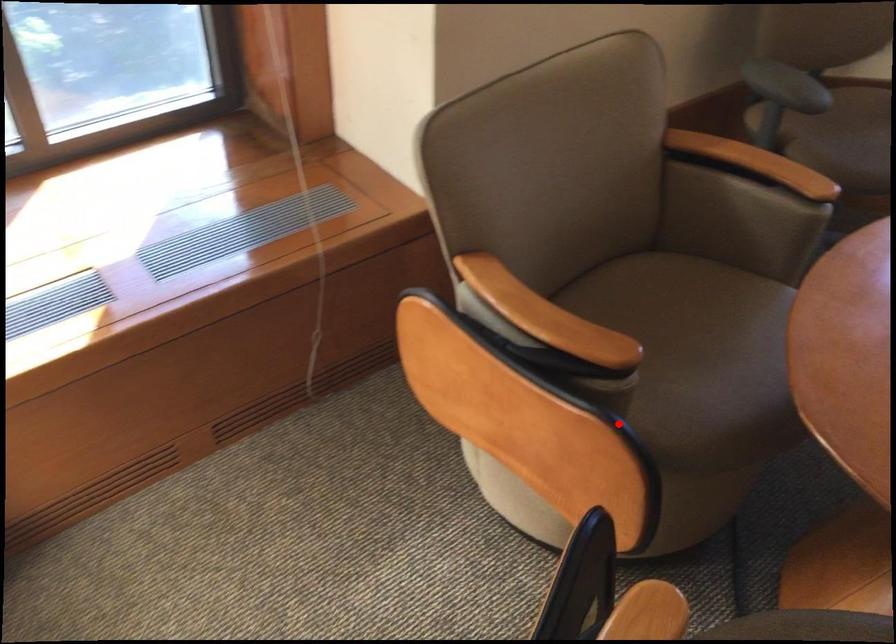
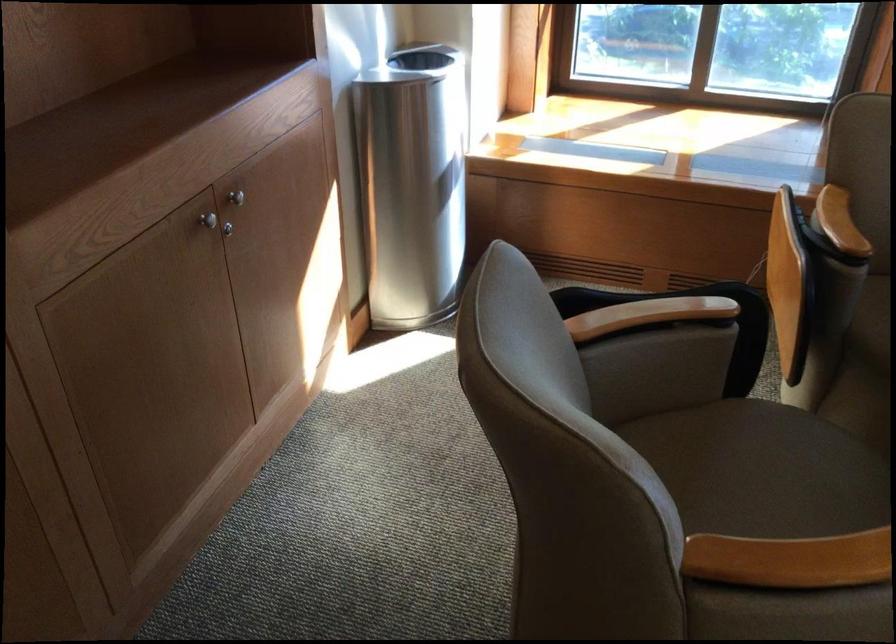
Where in the second image is the point corresponding to the highlighted location from the first image?

(855, 330)